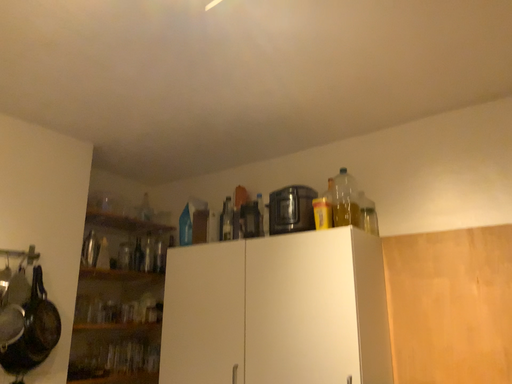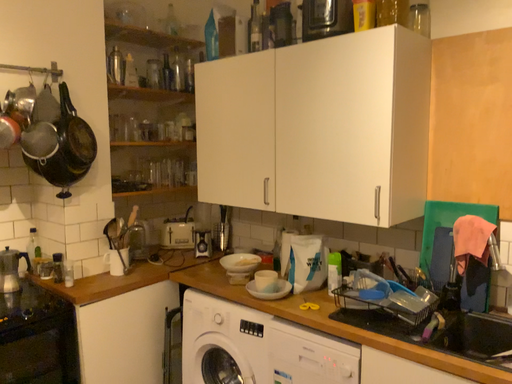
Question: How did the camera likely rotate when shooting the video?

Choices:
 (A) rotated left
 (B) rotated right

Answer: (A)